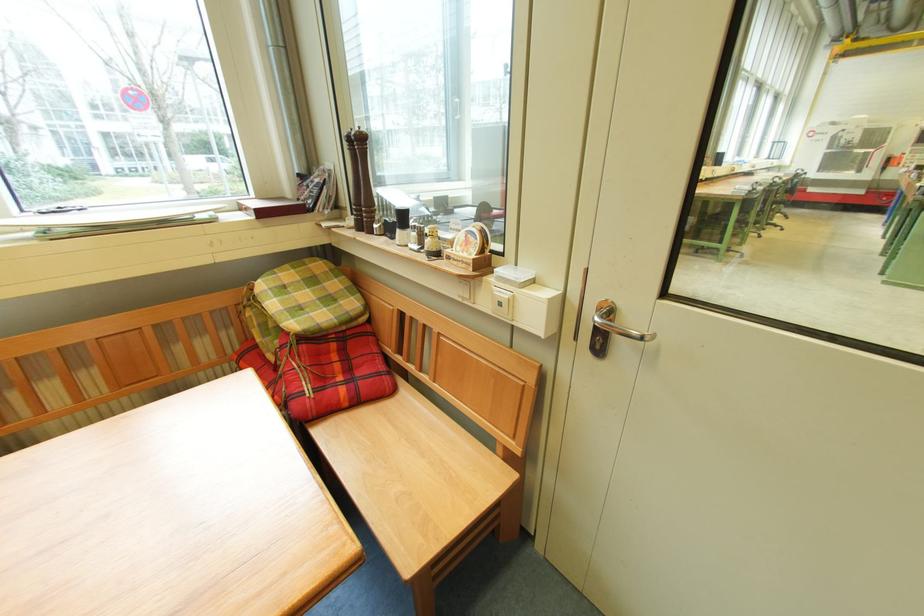
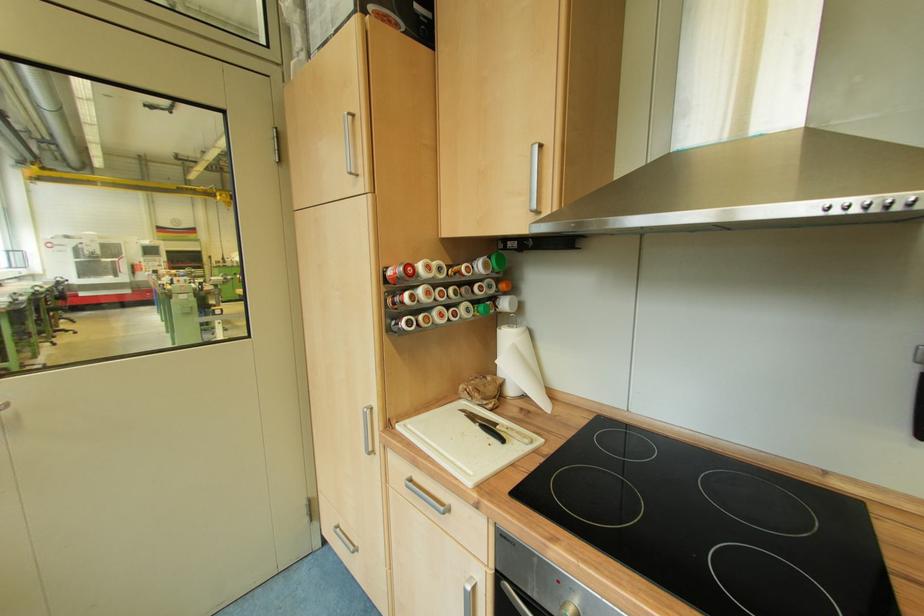
Question: How did the camera likely rotate?

Choices:
 (A) Left
 (B) Right
 (C) Up
 (D) Down

Answer: (B)